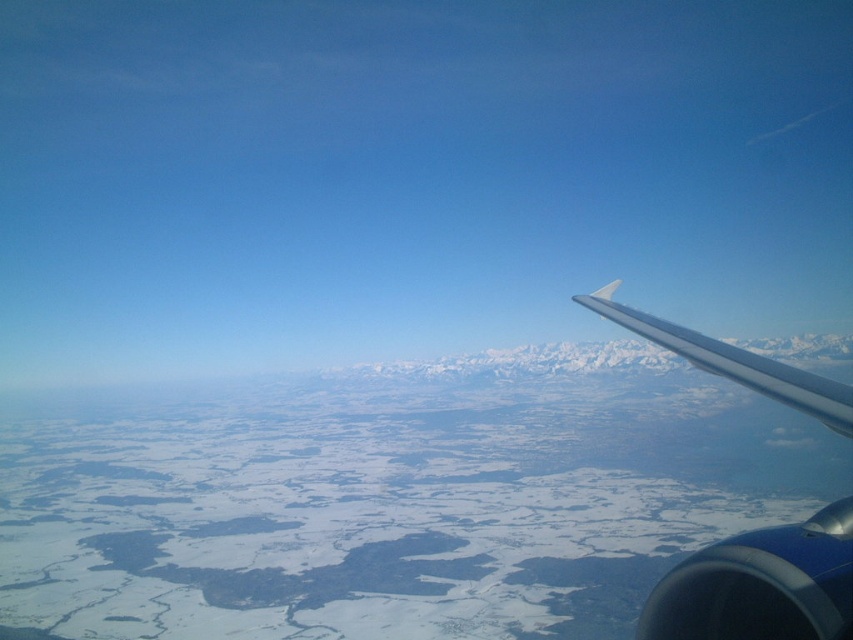
Question: Where is metallic silver wing at right located in relation to white glossy wing at upper right in the image?

Choices:
 (A) left
 (B) right

Answer: (A)

Question: Which point is farther to the camera?

Choices:
 (A) (700, 337)
 (B) (577, 296)

Answer: (B)

Question: Which object appears closest to the camera in this image?

Choices:
 (A) white glossy wing at upper right
 (B) metallic silver wing at right

Answer: (B)

Question: Is metallic silver wing at right to the right of white glossy wing at upper right from the viewer's perspective?

Choices:
 (A) yes
 (B) no

Answer: (B)

Question: Is metallic silver wing at right smaller than white glossy wing at upper right?

Choices:
 (A) yes
 (B) no

Answer: (A)